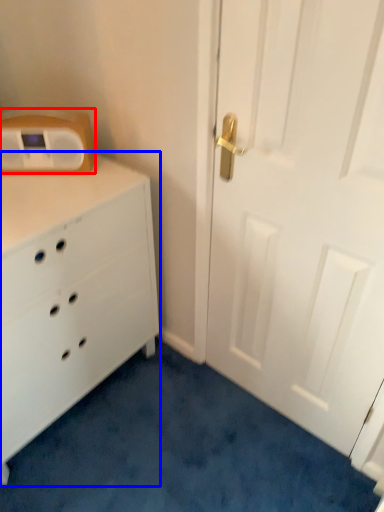
Question: Among these objects, which one is farthest to the camera, appliance (highlighted by a red box) or chest of drawers (highlighted by a blue box)?

Choices:
 (A) appliance
 (B) chest of drawers

Answer: (A)